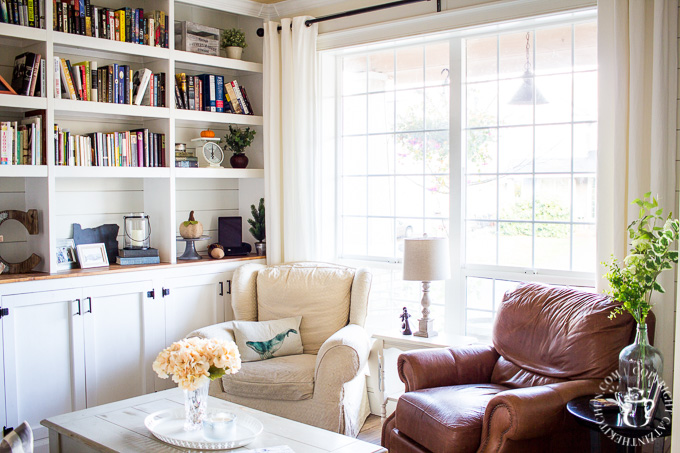
This screenshot has height=453, width=680. What are the coordinates of `pillow` in the screenshot? It's located at (273, 333).